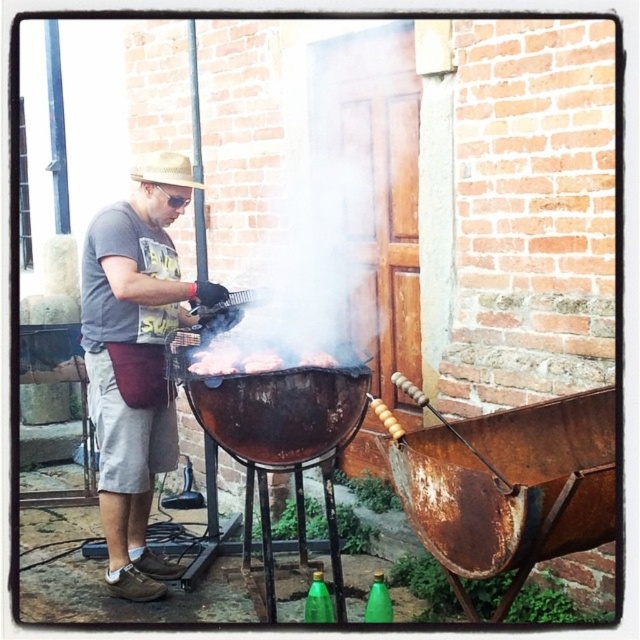
Identify the location of white smoke at center. (308, 250).

Can you confirm if white smoke at center is wider than smoky charred meat at center?

Indeed, white smoke at center has a greater width compared to smoky charred meat at center.

Describe the element at coordinates (308, 250) in the screenshot. The image size is (640, 640). I see `white smoke at center` at that location.

Identify the location of white smoke at center. point(308,250).

Looking at this image, between gray cotton shirt at center and white smoke at center, which one appears on the right side from the viewer's perspective?

white smoke at center is more to the right.

Image resolution: width=640 pixels, height=640 pixels. What do you see at coordinates (134, 369) in the screenshot? I see `gray cotton shirt at center` at bounding box center [134, 369].

This screenshot has width=640, height=640. I want to click on gray cotton shirt at center, so click(134, 369).

Consider the image. Is white smoke at center thinner than brown charred meat at center?

In fact, white smoke at center might be wider than brown charred meat at center.

Can you confirm if white smoke at center is shorter than brown charred meat at center?

In fact, white smoke at center may be taller than brown charred meat at center.

Does point (308, 268) come farther from viewer compared to point (323, 364)?

Yes, it is.

The height and width of the screenshot is (640, 640). What are the coordinates of `white smoke at center` in the screenshot? It's located at (308, 250).